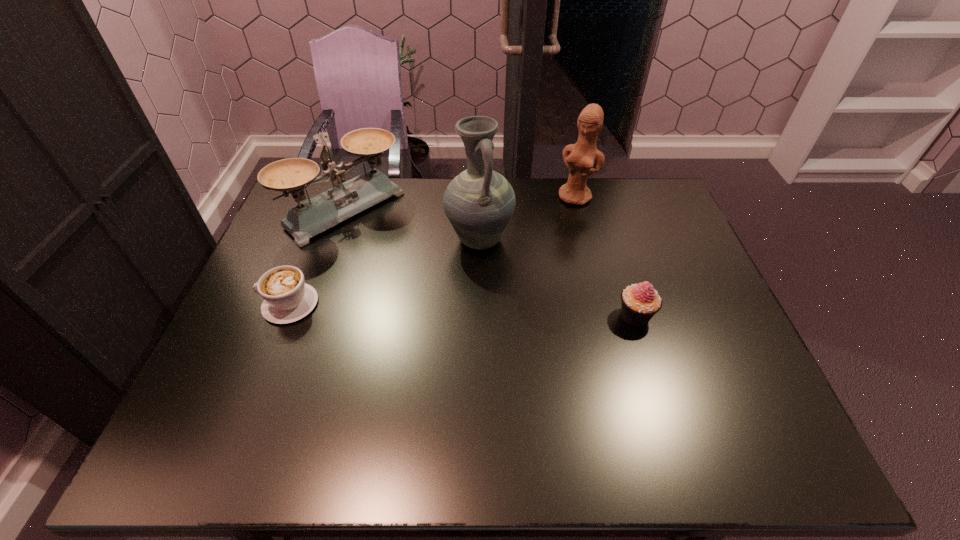
What are the coordinates of `the shortest object` in the screenshot? It's located at (287, 298).

Locate an element on the screen. This screenshot has width=960, height=540. cupcake is located at coordinates (640, 302).

The width and height of the screenshot is (960, 540). I want to click on the third tallest object, so click(x=315, y=215).

Locate an element on the screen. the third object from left to right is located at coordinates (479, 203).

Find the location of a particular element. This screenshot has height=540, width=960. pitcher is located at coordinates (479, 203).

You are a GUI agent. You are given a task and a screenshot of the screen. Output one action in this format:
    pyautogui.click(x=<x>, y=<y>)
    Task: Click on the figurine
    This screenshot has width=960, height=540.
    Given the screenshot: What is the action you would take?
    click(x=579, y=158)

Identify the location of vacant space located to the right of the shortest object's handle. The image size is (960, 540). (242, 304).

Locate an element on the screen. vacant space located on the back of the second shortest object is located at coordinates (616, 255).

I want to click on vacant space situated on the front-facing side of the scale, so click(404, 256).

You are a GUI agent. You are given a task and a screenshot of the screen. Output one action in this format:
    pyautogui.click(x=<x>, y=<y>)
    Task: Click on the vacant region located 0.230m on the front-facing side of the scale
    The height and width of the screenshot is (540, 960).
    Given the screenshot: What is the action you would take?
    pyautogui.click(x=425, y=273)